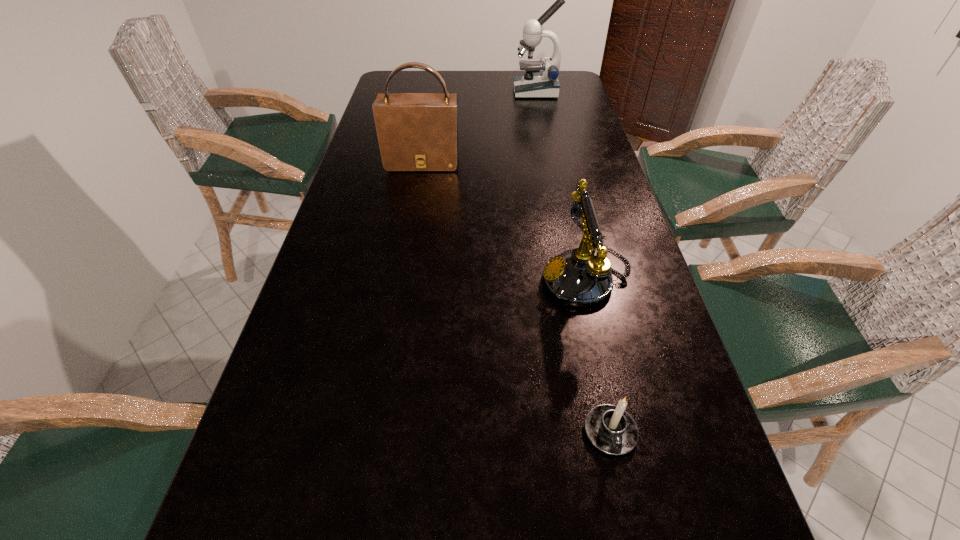
The height and width of the screenshot is (540, 960). In order to click on free space located on the dial of the third tallest object in this screenshot , I will do `click(492, 279)`.

Identify the location of vacant space positioned on the dial of the third tallest object. (416, 279).

I want to click on free space located with a handle on the side of the shortest object, so click(x=624, y=498).

This screenshot has height=540, width=960. Identify the location of object that is at the far edge. (545, 84).

I want to click on object located in the left edge section of the desktop, so click(x=417, y=132).

The image size is (960, 540). I want to click on microscope located at the right edge, so click(545, 84).

The image size is (960, 540). Identify the location of telephone located in the right edge section of the desktop. (579, 279).

Identify the location of candle holder that is at the right edge. (612, 430).

Image resolution: width=960 pixels, height=540 pixels. Find the location of `object at the far right corner`. object at the far right corner is located at coordinates (545, 84).

In the image, there is a desktop. Find the location of `vacant space at the far edge`. vacant space at the far edge is located at coordinates (500, 75).